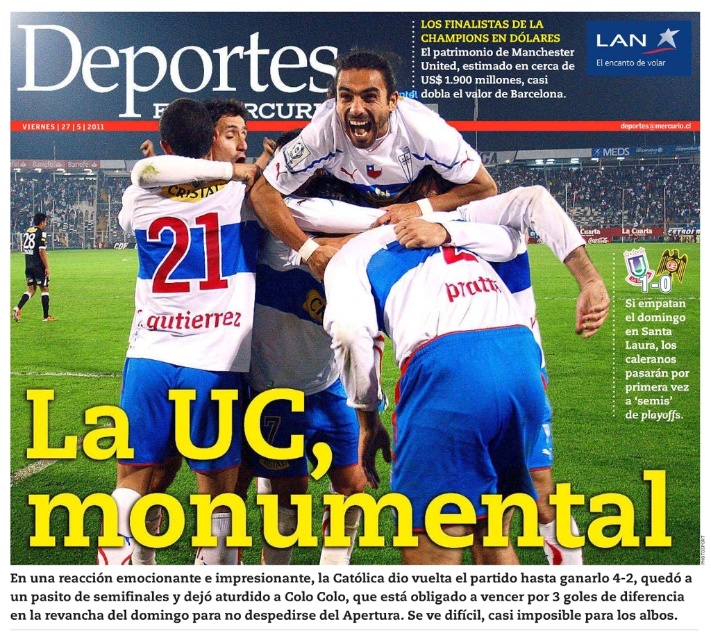
Does point (373, 60) come closer to viewer compared to point (33, 280)?

Yes, point (373, 60) is in front of point (33, 280).

Does white matte jersey at center have a lesser width compared to black jersey at lower left?

Correct, white matte jersey at center's width is less than black jersey at lower left's.

Between point (547, 520) and point (28, 260), which one is positioned in front?

Point (547, 520) is in front.

Find the location of a particular element. The image size is (711, 640). white matte jersey at center is located at coordinates (400, 140).

This screenshot has width=711, height=640. Describe the element at coordinates (186, 298) in the screenshot. I see `white jersey at center` at that location.

How distant is white jersey at center from white matte jersey at center?

A distance of 4.22 meters exists between white jersey at center and white matte jersey at center.

The height and width of the screenshot is (640, 711). What are the coordinates of `white jersey at center` in the screenshot? It's located at (186, 298).

The width and height of the screenshot is (711, 640). I want to click on white jersey at center, so click(x=186, y=298).

Is white jersey at center bigger than black jersey at lower left?

Yes, white jersey at center is bigger than black jersey at lower left.

Does white jersey at center have a greater width compared to black jersey at lower left?

No.

At what (x,y) coordinates should I click in order to perform the action: click on white jersey at center. Please return your answer as a coordinate pair (x, y). The height and width of the screenshot is (640, 711). Looking at the image, I should click on (186, 298).

Where is `white jersey at center`? white jersey at center is located at coordinates (186, 298).